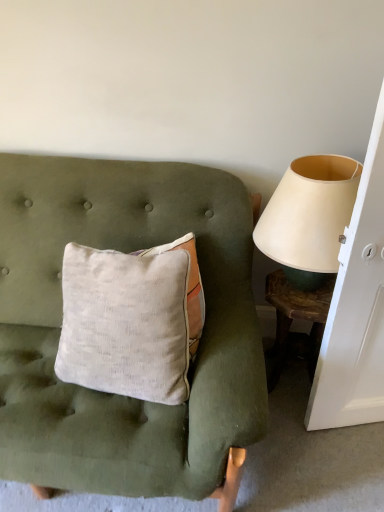
Question: Considering the relative positions of beige fabric lampshade at right and wooden textured side table at right in the image provided, is beige fabric lampshade at right to the right of wooden textured side table at right from the viewer's perspective?

Choices:
 (A) no
 (B) yes

Answer: (A)

Question: Is beige fabric lampshade at right further to camera compared to wooden textured side table at right?

Choices:
 (A) yes
 (B) no

Answer: (B)

Question: Does beige fabric lampshade at right have a lesser width compared to wooden textured side table at right?

Choices:
 (A) no
 (B) yes

Answer: (A)

Question: From a real-world perspective, is beige fabric lampshade at right positioned over wooden textured side table at right based on gravity?

Choices:
 (A) yes
 (B) no

Answer: (A)

Question: Can you confirm if beige fabric lampshade at right is positioned to the left of wooden textured side table at right?

Choices:
 (A) yes
 (B) no

Answer: (A)

Question: Is beige fabric lampshade at right touching wooden textured side table at right?

Choices:
 (A) no
 (B) yes

Answer: (A)

Question: Is textured linen pillow at center beside wooden textured side table at right?

Choices:
 (A) no
 (B) yes

Answer: (A)

Question: Considering the relative sizes of textured linen pillow at center and wooden textured side table at right in the image provided, is textured linen pillow at center smaller than wooden textured side table at right?

Choices:
 (A) no
 (B) yes

Answer: (A)

Question: Can you confirm if textured linen pillow at center is positioned to the right of wooden textured side table at right?

Choices:
 (A) no
 (B) yes

Answer: (A)

Question: Could you tell me if textured linen pillow at center is facing wooden textured side table at right?

Choices:
 (A) no
 (B) yes

Answer: (A)

Question: From a real-world perspective, does textured linen pillow at center stand above wooden textured side table at right?

Choices:
 (A) yes
 (B) no

Answer: (A)

Question: Is textured linen pillow at center turned away from wooden textured side table at right?

Choices:
 (A) yes
 (B) no

Answer: (B)

Question: Is wooden textured side table at right further to the viewer compared to beige fabric lampshade at right?

Choices:
 (A) no
 (B) yes

Answer: (B)